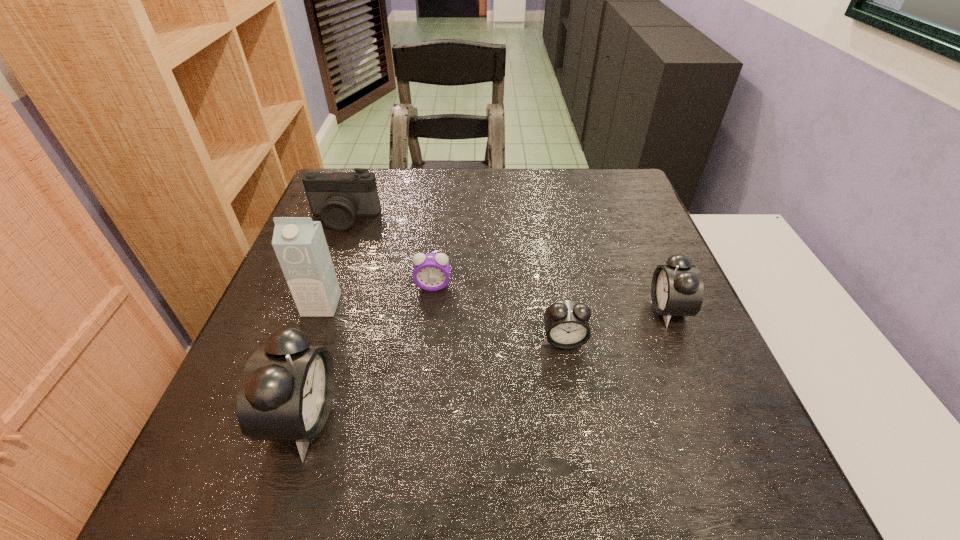
You are a GUI agent. You are given a task and a screenshot of the screen. Output one action in this format:
    pyautogui.click(x=<x>, y=<y>)
    Task: Click on the carton present at the left edge
    
    Given the screenshot: What is the action you would take?
    pyautogui.click(x=299, y=243)

Where is `camera that is at the left edge`? camera that is at the left edge is located at coordinates (338, 197).

Locate an element on the screen. The image size is (960, 540). object that is at the right edge is located at coordinates (677, 289).

The image size is (960, 540). Find the location of `object present at the far left corner`. object present at the far left corner is located at coordinates (338, 197).

This screenshot has width=960, height=540. I want to click on object that is at the near left corner, so click(x=286, y=390).

This screenshot has height=540, width=960. What are the coordinates of `vacant space at the far edge` in the screenshot? It's located at (503, 172).

In the image, there is a desktop. Identify the location of vacant space at the near edge. (573, 426).

Where is `vacant region at the right edge of the desktop`? The height and width of the screenshot is (540, 960). vacant region at the right edge of the desktop is located at coordinates (678, 374).

I want to click on free location at the far right corner, so click(x=625, y=214).

The image size is (960, 540). Find the location of `free spot between the third object from right to left and the rightmost object`. free spot between the third object from right to left and the rightmost object is located at coordinates (550, 298).